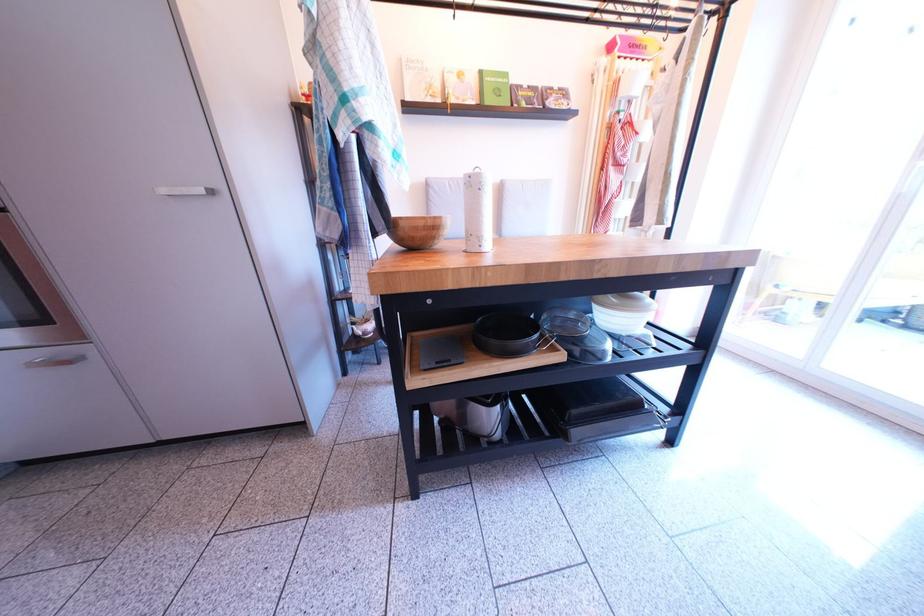
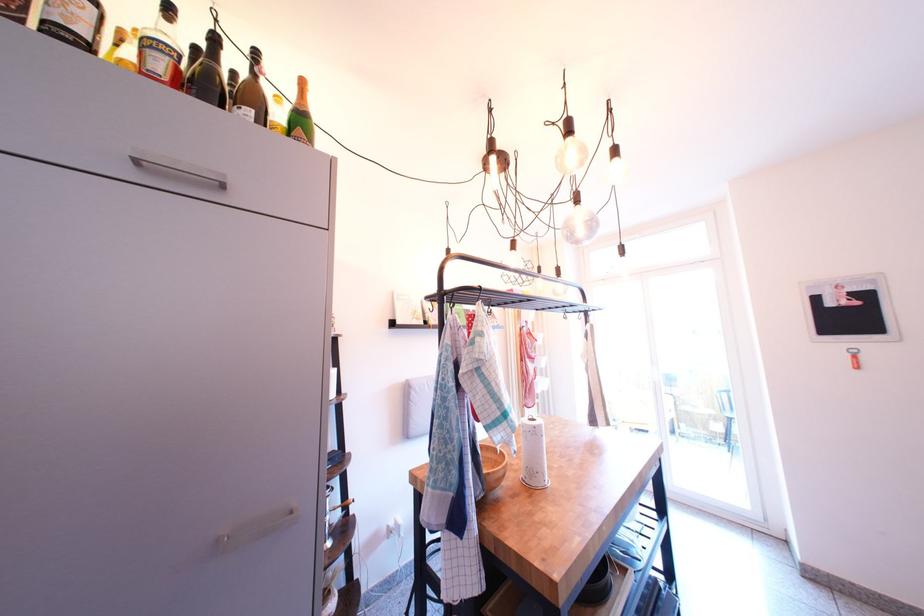
Find the pixel in the second image that matches [411,225] in the first image.

(500, 480)